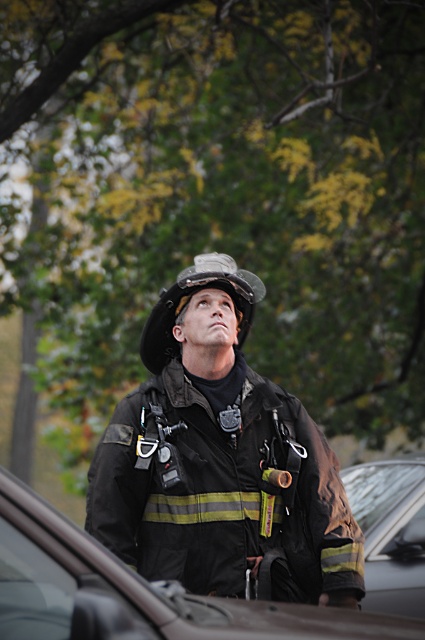
Question: Does black matte uniform at center have a larger size compared to black matte helmet at center?

Choices:
 (A) no
 (B) yes

Answer: (B)

Question: Does black glossy car at center appear on the left side of black matte helmet at center?

Choices:
 (A) yes
 (B) no

Answer: (B)

Question: Can you confirm if black glossy car at center is positioned below transparent glass car window at lower left?

Choices:
 (A) no
 (B) yes

Answer: (B)

Question: Which object appears closest to the camera in this image?

Choices:
 (A) black matte uniform at center
 (B) black glossy car at center
 (C) transparent glass car window at lower left
 (D) black matte helmet at center

Answer: (B)

Question: Which object appears closest to the camera in this image?

Choices:
 (A) black matte helmet at center
 (B) transparent glass car window at lower left

Answer: (B)

Question: Based on their relative distances, which object is farther from the black glossy car at center?

Choices:
 (A) transparent glass car window at lower left
 (B) black matte uniform at center
 (C) black matte helmet at center

Answer: (C)